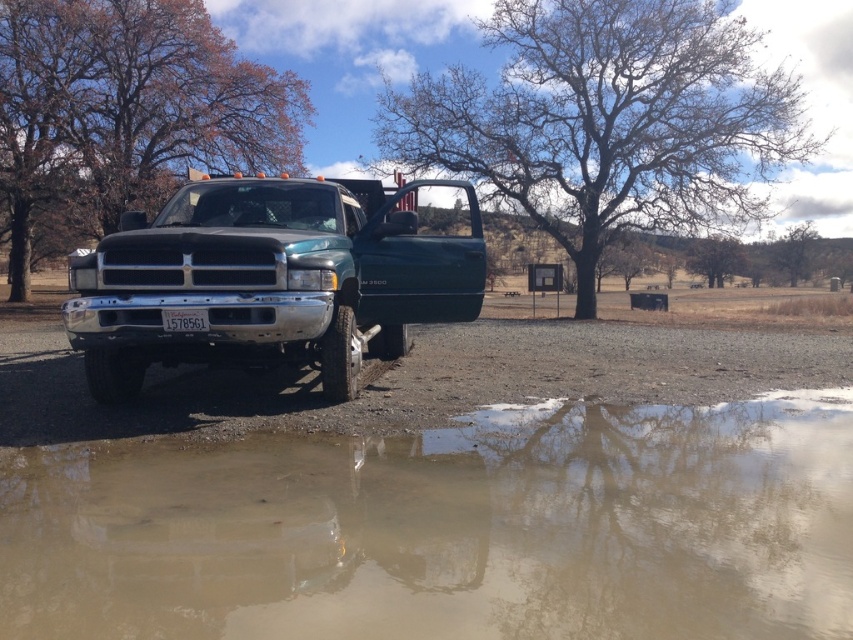
Question: Can you confirm if bare branches at upper center is wider than shiny black truck at center?

Choices:
 (A) no
 (B) yes

Answer: (B)

Question: Is brown muddy water at lower center to the left of bare branches tree at upper center from the viewer's perspective?

Choices:
 (A) yes
 (B) no

Answer: (A)

Question: Estimate the real-world distances between objects in this image. Which object is closer to the brown leafy tree at center?

Choices:
 (A) shiny black truck at center
 (B) bare branches at upper center
 (C) bare branches tree at upper center

Answer: (B)

Question: Estimate the real-world distances between objects in this image. Which object is closer to the bare branches tree at upper center?

Choices:
 (A) shiny black truck at center
 (B) green leafy tree at center

Answer: (B)

Question: Which of the following is the closest to the observer?

Choices:
 (A) brown muddy water at lower center
 (B) green leafy tree at center
 (C) bare branches at upper center

Answer: (A)

Question: Is brown muddy water at lower center to the left of brown leafy tree at center from the viewer's perspective?

Choices:
 (A) no
 (B) yes

Answer: (A)